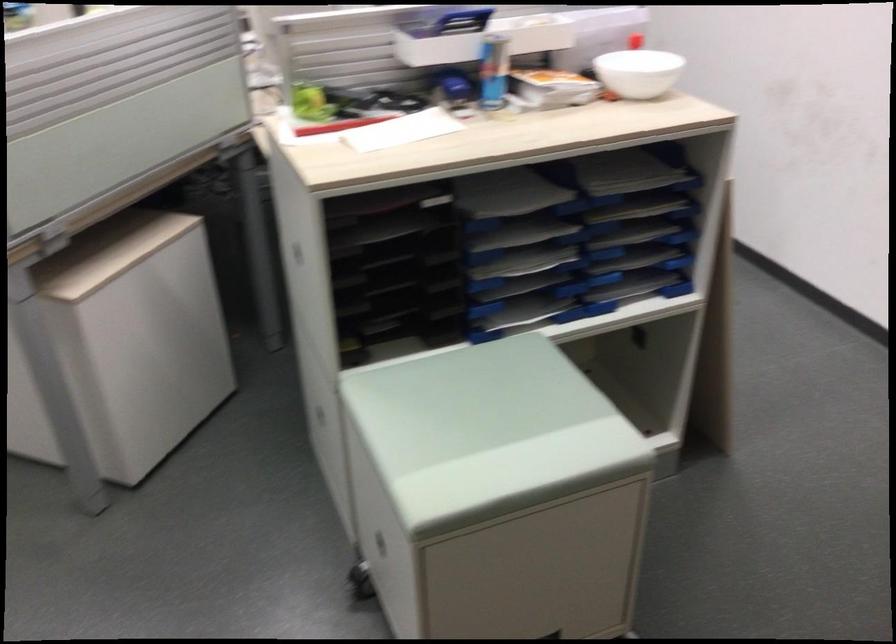
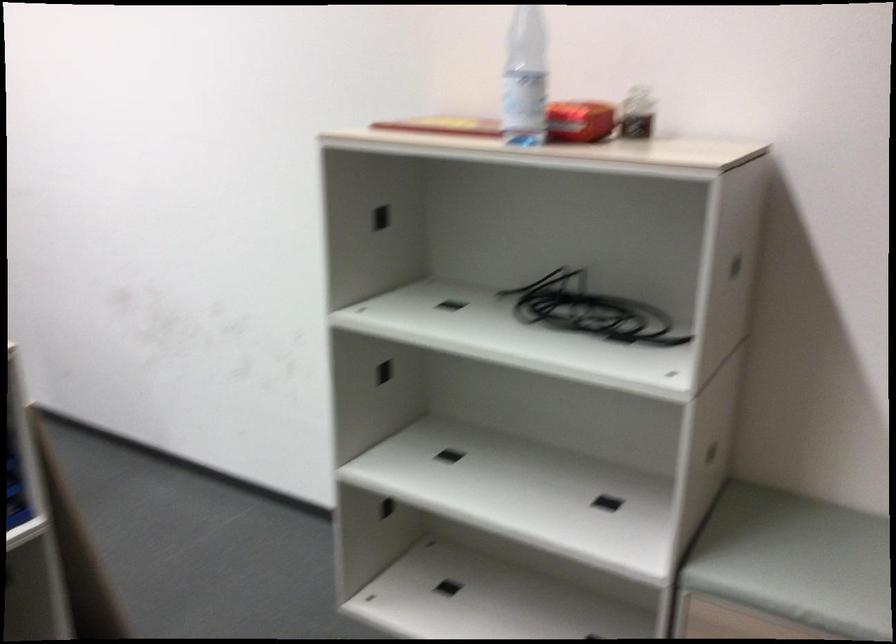
Question: The camera is either moving clockwise (left) or counter-clockwise (right) around the object. The first image is from the beginning of the video and the second image is from the end. Is the camera moving left or right when shooting the video?

Choices:
 (A) Left
 (B) Right

Answer: (A)